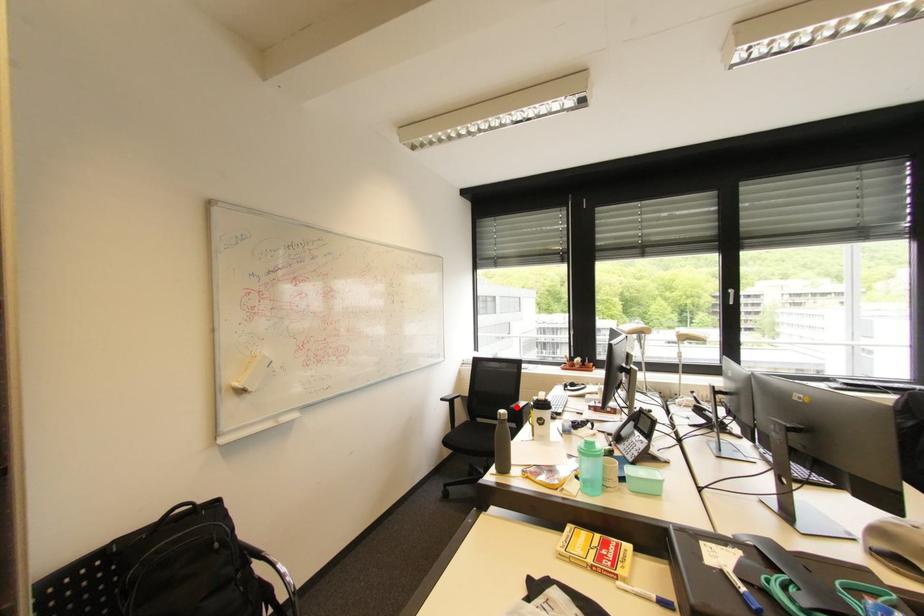
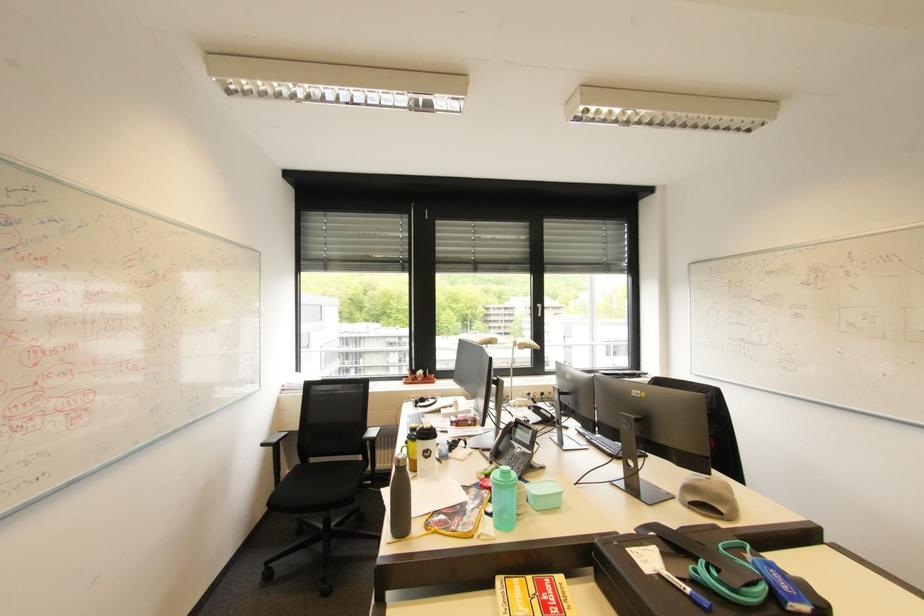
Locate, in the second image, the point that corresponds to the highlighted location in the first image.

(370, 438)